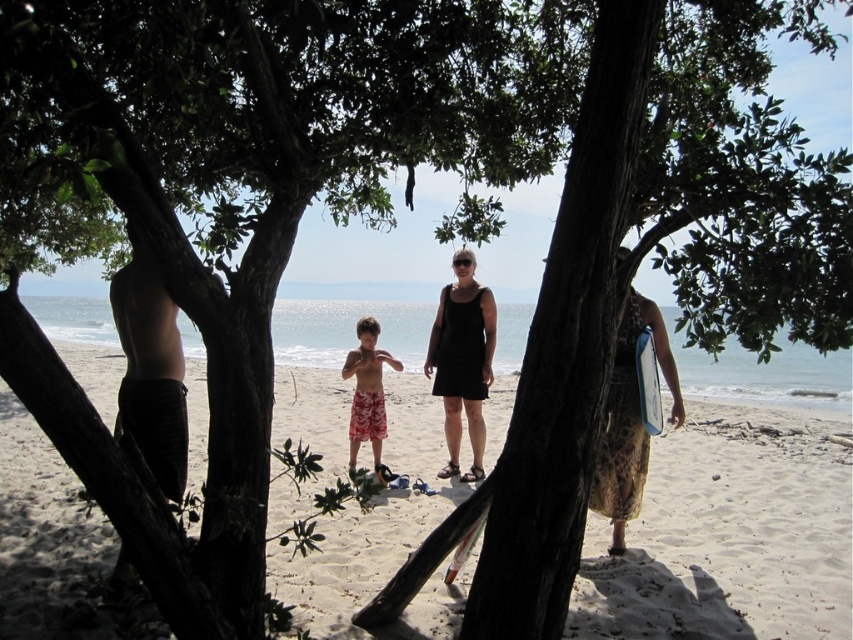
You are a photographer planning to take a picture of the beach scene. You notice the black fabric dress at center and the white matte surfboard at center. Which object should you focus on if you want to capture the larger one in your shot?

The black fabric dress at center is larger in size than the white matte surfboard at center, so you should focus on the black fabric dress at center to capture the larger one.

You are planning to place a small beach umbrella on the beige sand at center and the printed fabric dress at right. Which location would allow the umbrella to be placed without overlapping any existing objects?

The beige sand at center is bigger than the printed fabric dress at right, so placing the umbrella on the beige sand at center would provide more space and avoid overlapping existing objects.

You are a photographer trying to capture the black matte shorts at left in the scene. Where would you position your camera to best frame this subject?

To best frame the black matte shorts at left, position your camera at the 2D coordinates specified by the point 0.578 on the x axis and 0.177 on the y axis.